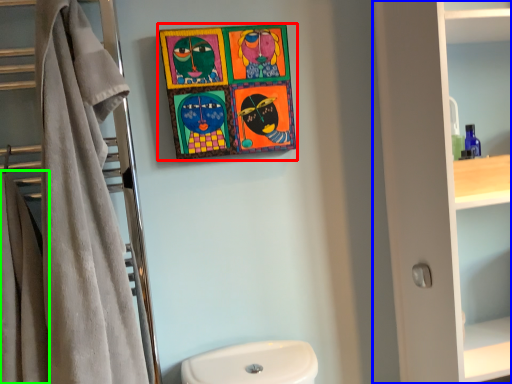
Question: Which is farther away from picture frame (highlighted by a red box)? bathroom cabinet (highlighted by a blue box) or bath towel (highlighted by a green box)?

Choices:
 (A) bathroom cabinet
 (B) bath towel

Answer: (B)